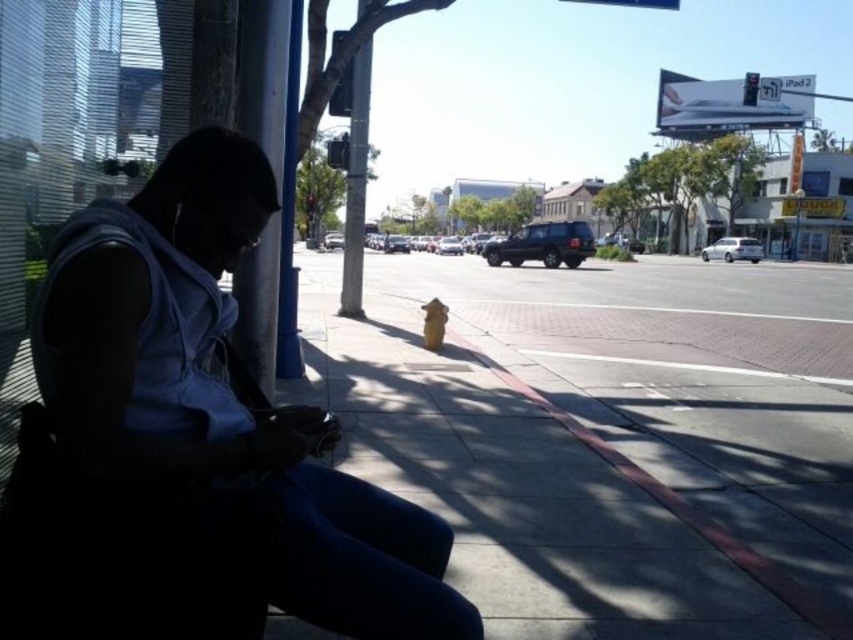
You are a pedestrian standing on the sidewalk and see the matte gray hoodie at left and the metallic pole at center. Which object is closer to the ground?

The matte gray hoodie at left is closer to the ground because it is positioned below the metallic pole at center.